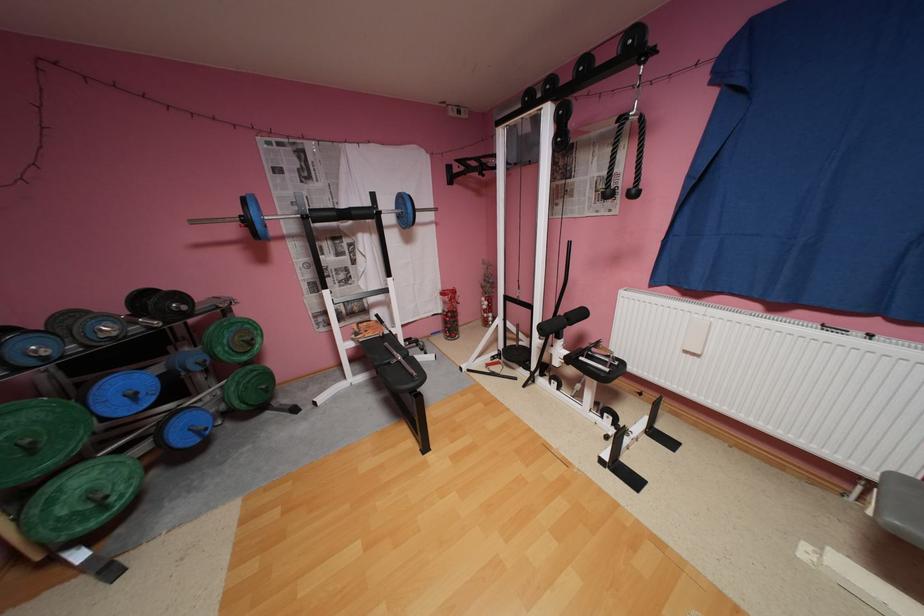
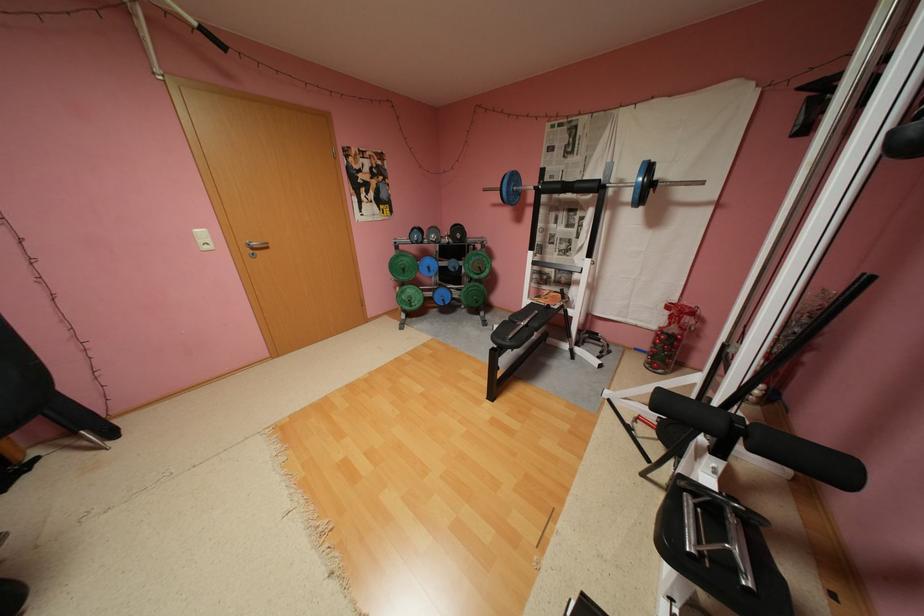
Question: I am providing you with two images of the same scene from different viewpoints. After the viewpoint changes to image2, which objects are now occluded?

Choices:
 (A) green weight plate
 (B) black pull-up grip
 (C) blue weight plate
 (D) none of these

Answer: (D)